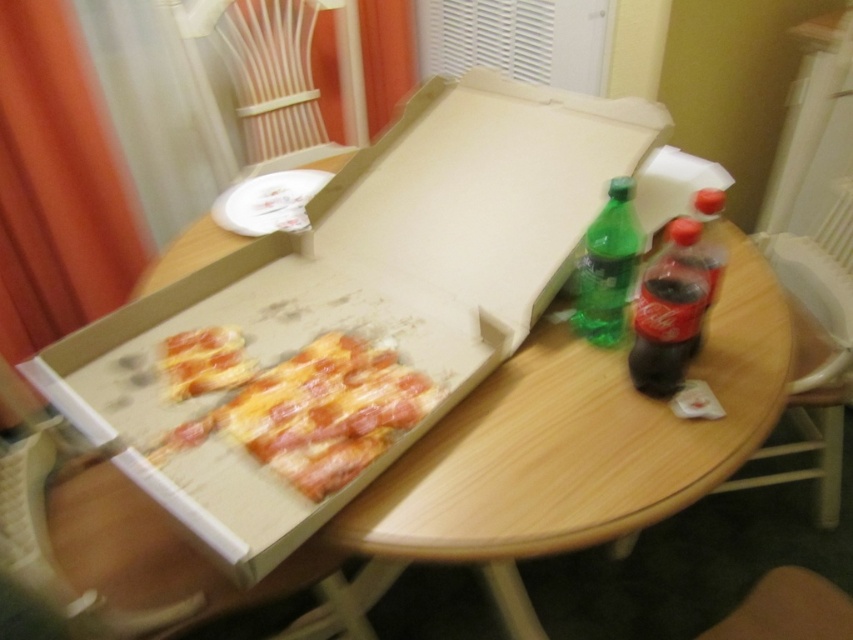
Question: Which point is farther to the camera?

Choices:
 (A) coord(227,426)
 (B) coord(345,509)

Answer: (A)

Question: Can you confirm if yellow cheese pizza at center is thinner than translucent plastic soda bottle at right?

Choices:
 (A) no
 (B) yes

Answer: (A)

Question: Does wooden at center come behind translucent plastic soda bottle at right?

Choices:
 (A) yes
 (B) no

Answer: (B)

Question: In this image, where is green matte soda bottle at right located relative to cheesy pepperoni pizza at center?

Choices:
 (A) below
 (B) above

Answer: (B)

Question: Which point is farther to the camera?

Choices:
 (A) (683, 307)
 (B) (347, 464)

Answer: (A)

Question: Based on their relative distances, which object is farther from the cheesy pepperoni pizza at center?

Choices:
 (A) translucent plastic soda bottle at right
 (B) green matte soda bottle at right

Answer: (A)